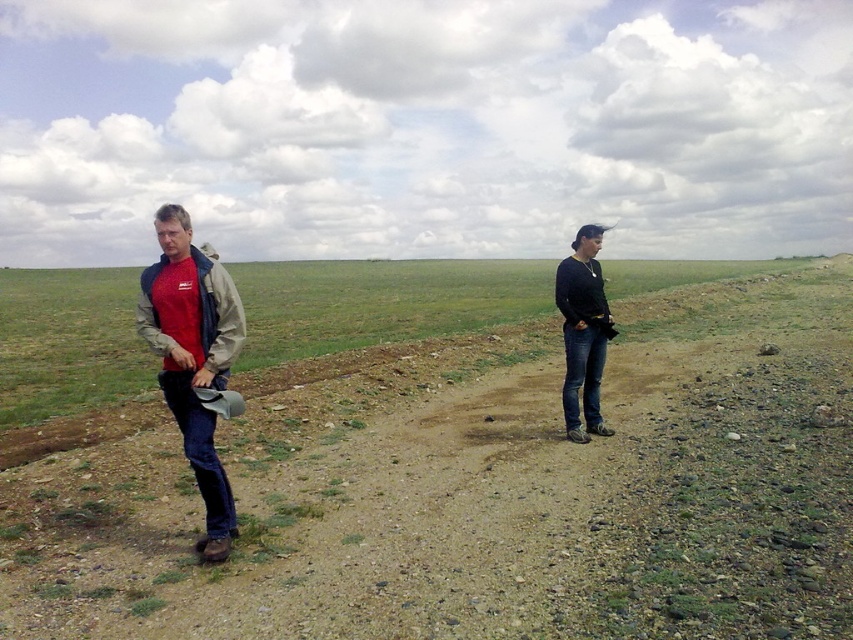
Can you confirm if dirt at center is smaller than black matte jacket at right?

Incorrect, dirt at center is not smaller in size than black matte jacket at right.

Which is more to the right, dirt at center or black matte jacket at right?

From the viewer's perspective, black matte jacket at right appears more on the right side.

Image resolution: width=853 pixels, height=640 pixels. What do you see at coordinates (476, 484) in the screenshot?
I see `dirt at center` at bounding box center [476, 484].

Identify the location of dirt at center. The width and height of the screenshot is (853, 640). (x=476, y=484).

Is matte red shirt at left thinner than black matte jacket at right?

Incorrect, matte red shirt at left's width is not less than black matte jacket at right's.

Is matte red shirt at left to the left of black matte jacket at right from the viewer's perspective?

Yes, matte red shirt at left is to the left of black matte jacket at right.

Find the location of a particular element. This screenshot has height=640, width=853. matte red shirt at left is located at coordinates (193, 356).

Who is more distant from viewer, (x=456, y=541) or (x=209, y=296)?

Positioned behind is point (x=456, y=541).

Which of these two, dirt at center or matte red shirt at left, stands taller?

dirt at center is taller.

Is point (612, 593) closer to camera compared to point (201, 417)?

Yes.

Identify the location of dirt at center. Image resolution: width=853 pixels, height=640 pixels. (476, 484).